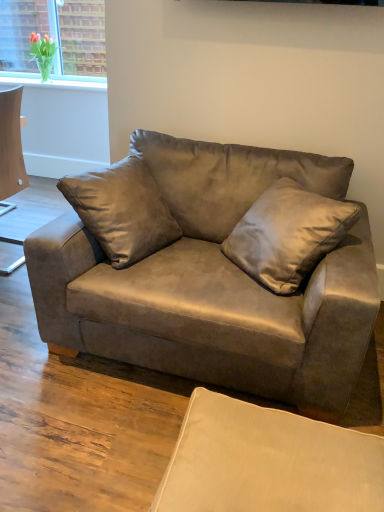
In order to click on empty space that is in between beige fabric swivel chair at lower right and suede couch at center in this screenshot , I will do `click(131, 419)`.